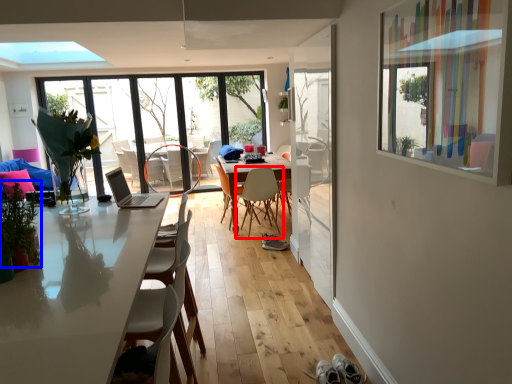
Question: Which object appears closest to the camera in this image, chair (highlighted by a red box) or plant (highlighted by a blue box)?

Choices:
 (A) chair
 (B) plant

Answer: (B)